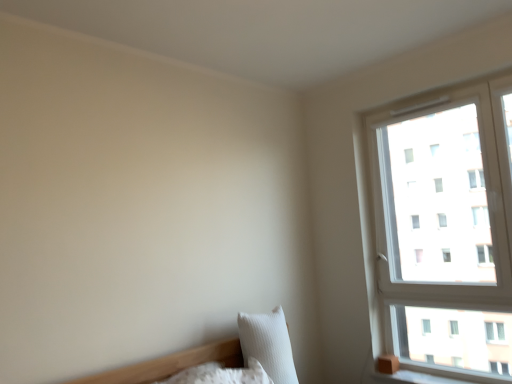
Find the location of a particular element. Image resolution: width=512 pixels, height=384 pixels. white textured pillow at lower right, positioned as the second pillow in left-to-right order is located at coordinates (268, 344).

The height and width of the screenshot is (384, 512). What do you see at coordinates (268, 344) in the screenshot?
I see `white textured pillow at lower right, arranged as the 1th pillow when viewed from the right` at bounding box center [268, 344].

Where is `white soft pillow at lower left, arranged as the first pillow when viewed from the left`? The image size is (512, 384). white soft pillow at lower left, arranged as the first pillow when viewed from the left is located at coordinates (221, 374).

The image size is (512, 384). What do you see at coordinates (221, 374) in the screenshot?
I see `white soft pillow at lower left, arranged as the first pillow when viewed from the left` at bounding box center [221, 374].

Locate an element on the screen. This screenshot has height=384, width=512. white plastic window at upper right is located at coordinates (444, 232).

How different are the orientations of white textured pillow at lower right, positioned as the second pillow in left-to-right order, and white soft pillow at lower left, which is the 2th pillow in right-to-left order, in degrees?

They differ by 0.779 degrees in their facing directions.

This screenshot has width=512, height=384. In order to click on pillow that is behind the white soft pillow at lower left, which is the 2th pillow in right-to-left order in this screenshot , I will do `click(268, 344)`.

In the scene shown: Considering the positions of objects white textured pillow at lower right, positioned as the second pillow in left-to-right order, and white soft pillow at lower left, arranged as the first pillow when viewed from the left, in the image provided, who is more to the right, white textured pillow at lower right, positioned as the second pillow in left-to-right order, or white soft pillow at lower left, arranged as the first pillow when viewed from the left,?

white textured pillow at lower right, positioned as the second pillow in left-to-right order.

Which of these two, white textured pillow at lower right, positioned as the second pillow in left-to-right order, or white soft pillow at lower left, arranged as the first pillow when viewed from the left, is bigger?

white textured pillow at lower right, positioned as the second pillow in left-to-right order.

Is white soft pillow at lower left, which is the 2th pillow in right-to-left order, facing away from white plastic window at upper right?

white soft pillow at lower left, which is the 2th pillow in right-to-left order, is not turned away from white plastic window at upper right.

Between white soft pillow at lower left, arranged as the first pillow when viewed from the left, and white plastic window at upper right, which one has more height?

white plastic window at upper right.

From a real-world perspective, is white soft pillow at lower left, which is the 2th pillow in right-to-left order, physically below white plastic window at upper right?

Yes.

Is white plastic window at upper right a part of white soft pillow at lower left, which is the 2th pillow in right-to-left order?

No, white plastic window at upper right is not surrounded by white soft pillow at lower left, which is the 2th pillow in right-to-left order.

How different are the orientations of white plastic window at upper right and white textured pillow at lower right, positioned as the second pillow in left-to-right order, in degrees?

They differ by 89.3 degrees in their facing directions.

Considering the positions of points (386, 254) and (275, 307), is point (386, 254) farther from camera compared to point (275, 307)?

That is True.

Would you say white plastic window at upper right is a long distance from white textured pillow at lower right, arranged as the 1th pillow when viewed from the right?

white plastic window at upper right is positioned a significant distance from white textured pillow at lower right, arranged as the 1th pillow when viewed from the right.

From a real-world perspective, which is physically above, white plastic window at upper right or white textured pillow at lower right, positioned as the second pillow in left-to-right order?

white plastic window at upper right.

From a real-world perspective, is white plastic window at upper right over white soft pillow at lower left, arranged as the first pillow when viewed from the left?

Correct, in the physical world, white plastic window at upper right is higher than white soft pillow at lower left, arranged as the first pillow when viewed from the left.

Who is shorter, white plastic window at upper right or white soft pillow at lower left, arranged as the first pillow when viewed from the left?

Standing shorter between the two is white soft pillow at lower left, arranged as the first pillow when viewed from the left.

Does point (425, 318) lie behind point (229, 379)?

That is True.

Does white textured pillow at lower right, arranged as the 1th pillow when viewed from the right, have a larger size compared to white plastic window at upper right?

Incorrect, white textured pillow at lower right, arranged as the 1th pillow when viewed from the right, is not larger than white plastic window at upper right.

How far apart are white textured pillow at lower right, arranged as the 1th pillow when viewed from the right, and white plastic window at upper right?

white textured pillow at lower right, arranged as the 1th pillow when viewed from the right, and white plastic window at upper right are 4.11 feet apart.

The height and width of the screenshot is (384, 512). Find the location of `window to the right of white textured pillow at lower right, positioned as the second pillow in left-to-right order`. window to the right of white textured pillow at lower right, positioned as the second pillow in left-to-right order is located at coordinates (444, 232).

In the scene shown: Can you tell me how much white textured pillow at lower right, positioned as the second pillow in left-to-right order, and white plastic window at upper right differ in facing direction?

The facing directions of white textured pillow at lower right, positioned as the second pillow in left-to-right order, and white plastic window at upper right are 89.3 degrees apart.

Which object is further away from the camera taking this photo, white soft pillow at lower left, arranged as the first pillow when viewed from the left, or white textured pillow at lower right, arranged as the 1th pillow when viewed from the right?

white textured pillow at lower right, arranged as the 1th pillow when viewed from the right.

Locate an element on the screen. pillow above the white soft pillow at lower left, which is the 2th pillow in right-to-left order (from the image's perspective) is located at coordinates [268, 344].

Based on their sizes in the image, would you say white soft pillow at lower left, arranged as the first pillow when viewed from the left, is bigger or smaller than white textured pillow at lower right, arranged as the 1th pillow when viewed from the right?

In the image, white soft pillow at lower left, arranged as the first pillow when viewed from the left, appears to be smaller than white textured pillow at lower right, arranged as the 1th pillow when viewed from the right.

What's the angular difference between white soft pillow at lower left, arranged as the first pillow when viewed from the left, and white textured pillow at lower right, arranged as the 1th pillow when viewed from the right,'s facing directions?

There is a 0.779-degree angle between the facing directions of white soft pillow at lower left, arranged as the first pillow when viewed from the left, and white textured pillow at lower right, arranged as the 1th pillow when viewed from the right.

This screenshot has height=384, width=512. Identify the location of pillow above the white soft pillow at lower left, arranged as the first pillow when viewed from the left (from a real-world perspective). (268, 344).

Find the location of `pillow that is the 2nd object directly below the white plastic window at upper right (from a real-world perspective)`. pillow that is the 2nd object directly below the white plastic window at upper right (from a real-world perspective) is located at coordinates (221, 374).

Estimate the real-world distances between objects in this image. Which object is closer to white soft pillow at lower left, which is the 2th pillow in right-to-left order, white textured pillow at lower right, arranged as the 1th pillow when viewed from the right, or white plastic window at upper right?

white textured pillow at lower right, arranged as the 1th pillow when viewed from the right, lies closer to white soft pillow at lower left, which is the 2th pillow in right-to-left order, than the other object.

When comparing their distances from white textured pillow at lower right, positioned as the second pillow in left-to-right order, does white plastic window at upper right or white soft pillow at lower left, which is the 2th pillow in right-to-left order, seem closer?

white soft pillow at lower left, which is the 2th pillow in right-to-left order, is closer to white textured pillow at lower right, positioned as the second pillow in left-to-right order.

When comparing their distances from white plastic window at upper right, does white soft pillow at lower left, arranged as the first pillow when viewed from the left, or white textured pillow at lower right, positioned as the second pillow in left-to-right order, seem closer?

white textured pillow at lower right, positioned as the second pillow in left-to-right order.

From the image, which object appears to be farther from white textured pillow at lower right, arranged as the 1th pillow when viewed from the right, white soft pillow at lower left, which is the 2th pillow in right-to-left order, or white plastic window at upper right?

white plastic window at upper right lies further to white textured pillow at lower right, arranged as the 1th pillow when viewed from the right, than the other object.

Looking at the image, which one is located closer to white plastic window at upper right, white textured pillow at lower right, arranged as the 1th pillow when viewed from the right, or white soft pillow at lower left, which is the 2th pillow in right-to-left order?

The object closer to white plastic window at upper right is white textured pillow at lower right, arranged as the 1th pillow when viewed from the right.

Based on their spatial positions, is white plastic window at upper right or white textured pillow at lower right, positioned as the second pillow in left-to-right order, further from white soft pillow at lower left, arranged as the first pillow when viewed from the left?

Based on the image, white plastic window at upper right appears to be further to white soft pillow at lower left, arranged as the first pillow when viewed from the left.

Where is `pillow located between white soft pillow at lower left, which is the 2th pillow in right-to-left order, and white plastic window at upper right in the left-right direction`? pillow located between white soft pillow at lower left, which is the 2th pillow in right-to-left order, and white plastic window at upper right in the left-right direction is located at coordinates (268, 344).